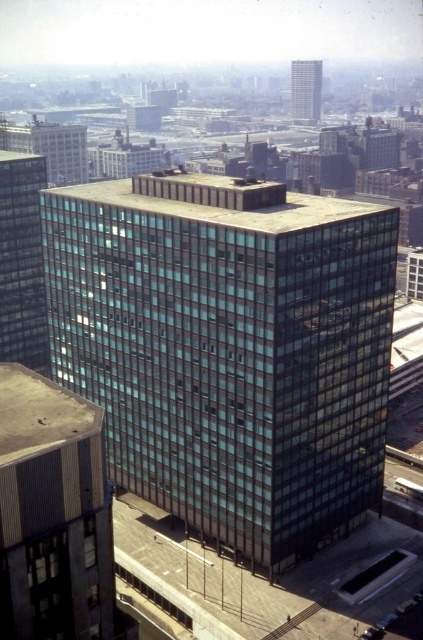
Question: Is glassy black building at center positioned behind glassy reflective building at left?

Choices:
 (A) yes
 (B) no

Answer: (B)

Question: Can you confirm if glassy black building at center is positioned below glassy reflective building at left?

Choices:
 (A) yes
 (B) no

Answer: (A)

Question: Considering the real-world distances, which object is closest to the glassy reflective building at left?

Choices:
 (A) glassy reflective skyscraper at upper center
 (B) glassy black building at center

Answer: (B)

Question: Estimate the real-world distances between objects in this image. Which object is farther from the glassy reflective skyscraper at upper center?

Choices:
 (A) glassy reflective building at left
 (B) glassy black building at center

Answer: (B)

Question: Is glassy black building at center to the right of glassy reflective skyscraper at upper center from the viewer's perspective?

Choices:
 (A) no
 (B) yes

Answer: (A)

Question: Which of the following is the closest to the observer?

Choices:
 (A) (304, 90)
 (B) (332, 358)

Answer: (B)